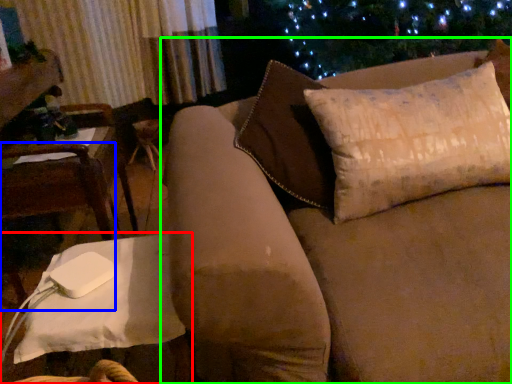
Question: Which object is positioned closest to table (highlighted by a red box)? Select from chair (highlighted by a blue box) and studio couch (highlighted by a green box).

Choices:
 (A) chair
 (B) studio couch

Answer: (B)